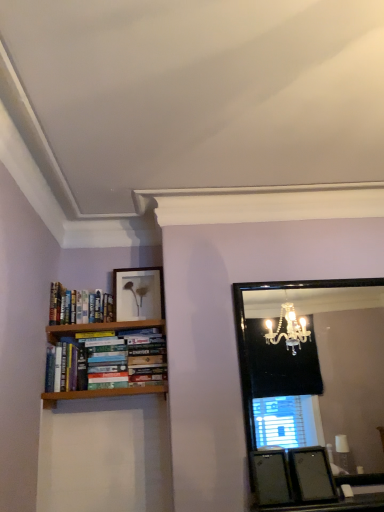
Question: Would you say black glass mirror at upper right is inside or outside matte white picture frame at upper center, which ranks as the 2th picture frame in right-to-left order?

Choices:
 (A) inside
 (B) outside

Answer: (B)

Question: Based on their positions, is black glass mirror at upper right located to the left or right of matte white picture frame at upper center, the 2th picture frame from the bottom?

Choices:
 (A) right
 (B) left

Answer: (A)

Question: Which is farther from the matte black picture frame at lower right, the second picture frame in the left-to-right sequence?

Choices:
 (A) hardcover books at left
 (B) matte white picture frame at upper center, positioned as the 2th picture frame in front-to-back order
 (C) black glass mirror at upper right

Answer: (C)

Question: Estimate the real-world distances between objects in this image. Which object is closer to the matte white picture frame at upper center, the 2th picture frame from the bottom?

Choices:
 (A) hardcover books at left
 (B) black glass mirror at upper right
 (C) matte black picture frame at lower right, the first picture frame in the front-to-back sequence

Answer: (A)